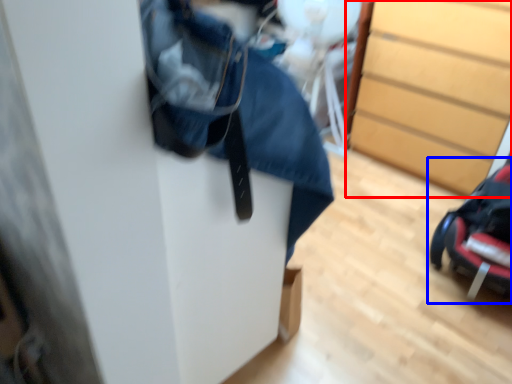
Question: Which point is closer to the camera, chest of drawers (highlighted by a red box) or baby carriage (highlighted by a blue box)?

Choices:
 (A) chest of drawers
 (B) baby carriage

Answer: (B)